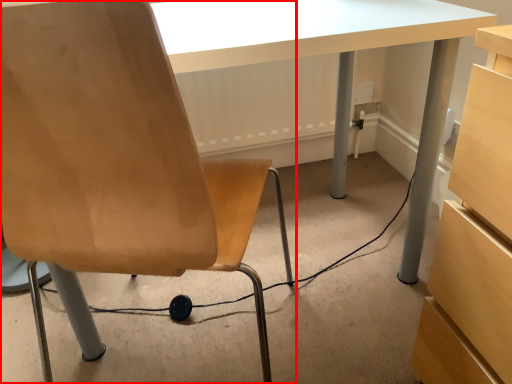
Question: From the image's perspective, where is chair (annotated by the red box) located relative to cable?

Choices:
 (A) below
 (B) above

Answer: (B)